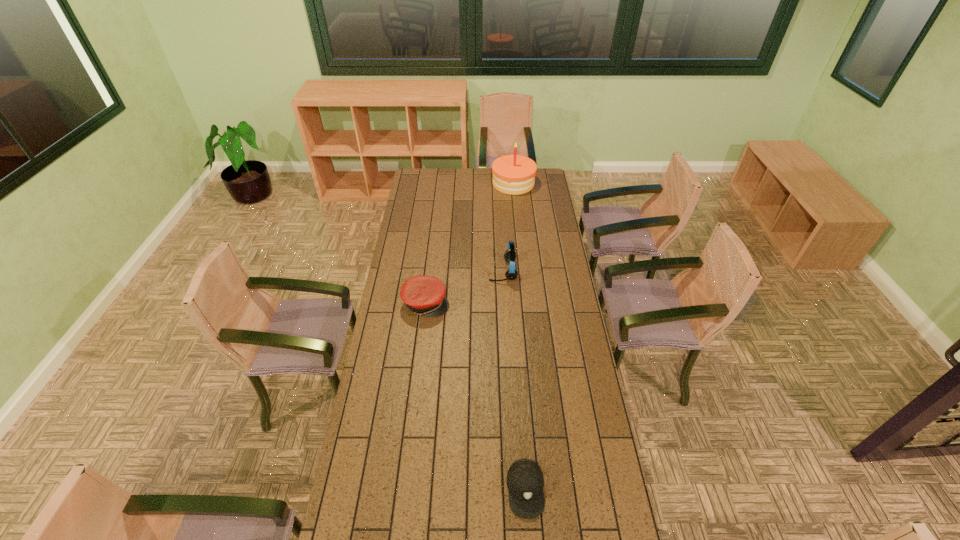
Where is `free space at the far left corner`? free space at the far left corner is located at coordinates (418, 176).

In the image, there is a desktop. Identify the location of vacant space at the far right corner. The image size is (960, 540). (534, 187).

At what (x,y) coordinates should I click in order to perform the action: click on empty space between the nearest object and the tallest object. Please return your answer as a coordinate pair (x, y). This screenshot has height=540, width=960. Looking at the image, I should click on (x=519, y=336).

Find the location of `vacant area that lies between the birthday cake and the headset`. vacant area that lies between the birthday cake and the headset is located at coordinates [x=508, y=227].

Where is `free point between the third nearest object and the third farthest object`? free point between the third nearest object and the third farthest object is located at coordinates (465, 287).

Where is `vacant space that's between the birthday cake and the taller cap`? vacant space that's between the birthday cake and the taller cap is located at coordinates (469, 244).

This screenshot has height=540, width=960. In order to click on free space between the nearer cap and the second tallest object in this screenshot , I will do `click(515, 380)`.

I want to click on free space between the birthday cake and the shortest object, so click(519, 336).

Select which object appears as the second closest to the third farthest object. Please provide its 2D coordinates. Your answer should be formatted as a tuple, i.e. [(x, y)], where the tuple contains the x and y coordinates of a point satisfying the conditions above.

[(525, 481)]

You are a GUI agent. You are given a task and a screenshot of the screen. Output one action in this format:
    pyautogui.click(x=<x>, y=<y>)
    Task: Click on the third closest object to the shortest object
    The height and width of the screenshot is (540, 960).
    Given the screenshot: What is the action you would take?
    pyautogui.click(x=514, y=174)